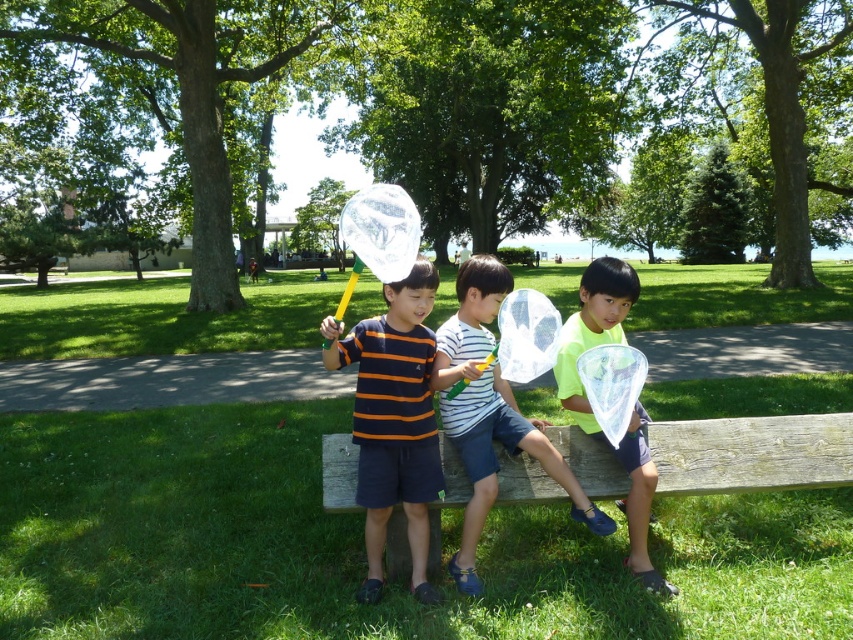
Question: Which of these objects is positioned farthest from the neon yellow t-shirt at center?

Choices:
 (A) wooden bench at center
 (B) striped cotton shirt at center

Answer: (A)

Question: Can you confirm if wooden bench at center is thinner than striped cotton shirt at center?

Choices:
 (A) yes
 (B) no

Answer: (B)

Question: Which of the following is the farthest from the observer?

Choices:
 (A) (569, 349)
 (B) (570, 465)
 (C) (416, 548)

Answer: (B)

Question: Which of the following is the closest to the observer?

Choices:
 (A) neon yellow t-shirt at center
 (B) striped cotton shirt at center

Answer: (B)

Question: Can you confirm if wooden bench at center is positioned above striped cotton shirt at center?

Choices:
 (A) yes
 (B) no

Answer: (B)

Question: Is wooden bench at center closer to the viewer compared to neon yellow t-shirt at center?

Choices:
 (A) yes
 (B) no

Answer: (B)